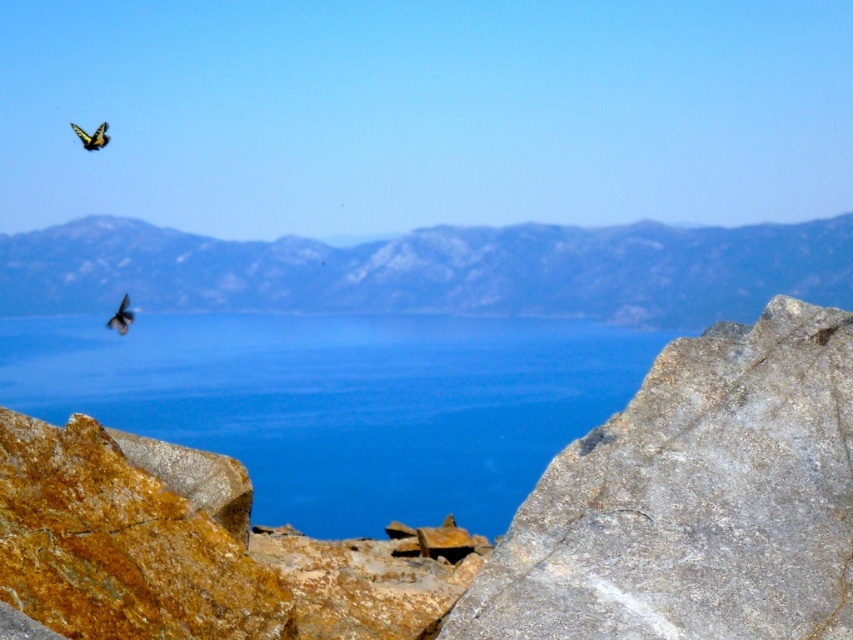
You are an ornithologist observing the scene. You notice the yellow patterned butterfly at upper left and the shiny black bird at upper left. Which of these two has a smaller wingspan?

The yellow patterned butterfly at upper left has a lesser width compared to the shiny black bird at upper left, so the yellow patterned butterfly at upper left has a smaller wingspan.

Based on the scene description, where is the blue water at center located in terms of coordinates?

The blue water at center is located at coordinates point (341,403).